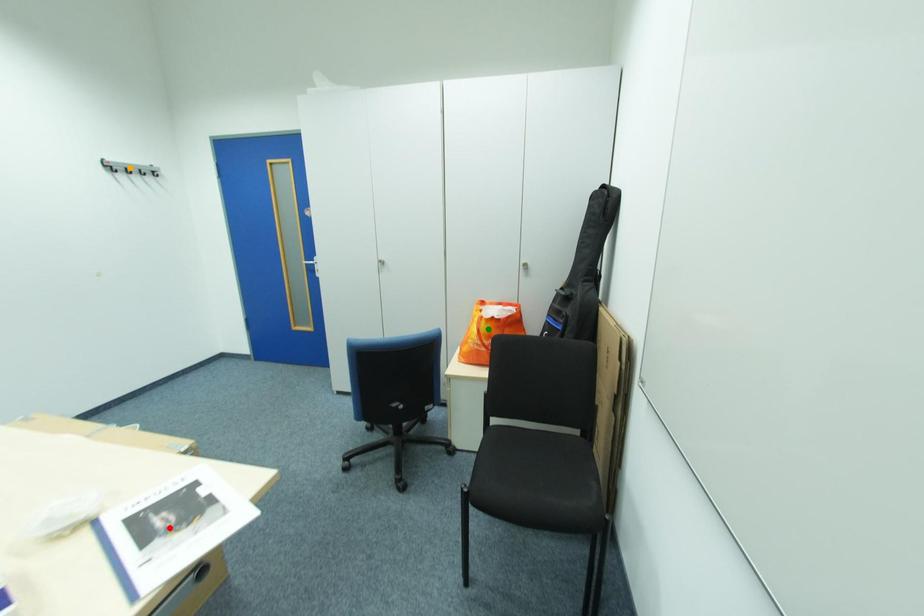
Order these from nearest to farthest:
A) green point
B) orange point
C) red point

1. red point
2. green point
3. orange point